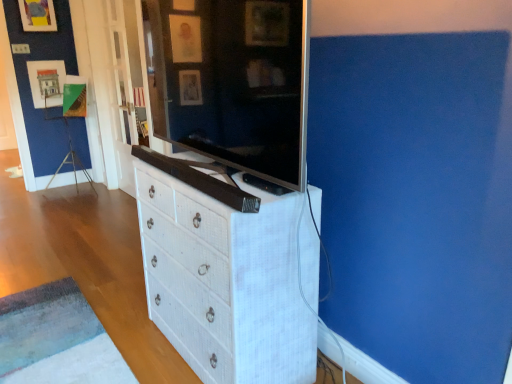
Locate an element on the screen. The image size is (512, 384). matte black television at center is located at coordinates (232, 82).

The width and height of the screenshot is (512, 384). Describe the element at coordinates (232, 82) in the screenshot. I see `matte black television at center` at that location.

The height and width of the screenshot is (384, 512). Identify the location of white textured chest of drawers at center. (225, 282).

The width and height of the screenshot is (512, 384). What do you see at coordinates (225, 282) in the screenshot?
I see `white textured chest of drawers at center` at bounding box center [225, 282].

In order to face white textured chest of drawers at center, should I rotate leftwards or rightwards?

It's best to rotate left around 4.007 degrees.

Locate an element on the screen. Image resolution: width=512 pixels, height=384 pixels. matte black television at center is located at coordinates (232, 82).

Considering the relative positions of matte black television at center and white textured chest of drawers at center in the image provided, is matte black television at center to the right of white textured chest of drawers at center from the viewer's perspective?

Incorrect, matte black television at center is not on the right side of white textured chest of drawers at center.

Between matte black television at center and white textured chest of drawers at center, which one is positioned behind?

white textured chest of drawers at center is further away from the camera.

Does point (178, 85) come farther from viewer compared to point (262, 273)?

Yes, it is behind point (262, 273).

From the image's perspective, does matte black television at center appear higher than white textured chest of drawers at center?

Correct, matte black television at center appears higher than white textured chest of drawers at center in the image.

From a real-world perspective, between matte black television at center and white textured chest of drawers at center, who is vertically higher?

matte black television at center.

Considering the sizes of objects matte black television at center and white textured chest of drawers at center in the image provided, who is thinner, matte black television at center or white textured chest of drawers at center?

Thinner between the two is matte black television at center.

From their relative heights in the image, would you say matte black television at center is taller or shorter than white textured chest of drawers at center?

Clearly, matte black television at center is shorter compared to white textured chest of drawers at center.

In terms of size, does matte black television at center appear bigger or smaller than white textured chest of drawers at center?

matte black television at center is smaller than white textured chest of drawers at center.

Could white textured chest of drawers at center be considered to be inside matte black television at center?

That's incorrect, white textured chest of drawers at center is not inside matte black television at center.

Is matte black television at center directly adjacent to white textured chest of drawers at center?

No, matte black television at center is not touching white textured chest of drawers at center.

Is matte black television at center aimed at white textured chest of drawers at center?

No, matte black television at center is not turned towards white textured chest of drawers at center.

I want to click on the chest of drawers directly beneath the matte black television at center (from a real-world perspective), so click(x=225, y=282).

Would you say white textured chest of drawers at center is to the left or to the right of matte black television at center in the picture?

From the image, it's evident that white textured chest of drawers at center is to the right of matte black television at center.

Is the position of white textured chest of drawers at center less distant than that of matte black television at center?

No, white textured chest of drawers at center is further to the viewer.

Is point (228, 245) closer to camera compared to point (273, 37)?

No.

From the image's perspective, which one is positioned higher, white textured chest of drawers at center or matte black television at center?

matte black television at center appears higher in the image.

From a real-world perspective, is white textured chest of drawers at center located beneath matte black television at center?

Yes, from a real-world perspective, white textured chest of drawers at center is under matte black television at center.

From the picture: Considering the sizes of white textured chest of drawers at center and matte black television at center in the image, is white textured chest of drawers at center wider or thinner than matte black television at center?

Clearly, white textured chest of drawers at center has more width compared to matte black television at center.

Considering the relative sizes of white textured chest of drawers at center and matte black television at center in the image provided, is white textured chest of drawers at center taller than matte black television at center?

Yes, white textured chest of drawers at center is taller than matte black television at center.

Between white textured chest of drawers at center and matte black television at center, which one has smaller size?

With smaller size is matte black television at center.

Is white textured chest of drawers at center completely or partially outside of matte black television at center?

Yes.

Is the surface of white textured chest of drawers at center in direct contact with matte black television at center?

They are not placed beside each other.

Is white textured chest of drawers at center facing away from matte black television at center?

That's not correct — white textured chest of drawers at center is not looking away from matte black television at center.

What's the angular difference between white textured chest of drawers at center and matte black television at center's facing directions?

white textured chest of drawers at center and matte black television at center are facing 1.33 degrees away from each other.

How far apart are white textured chest of drawers at center and matte black television at center?

The distance of white textured chest of drawers at center from matte black television at center is 16.44 inches.

Where is `chest of drawers below the matte black television at center (from the image's perspective)`? This screenshot has width=512, height=384. chest of drawers below the matte black television at center (from the image's perspective) is located at coordinates (225, 282).

This screenshot has height=384, width=512. Identify the location of the chest of drawers that is behind the matte black television at center. (225, 282).

Find the location of `television above the white textured chest of drawers at center (from a real-world perspective)`. television above the white textured chest of drawers at center (from a real-world perspective) is located at coordinates (232, 82).